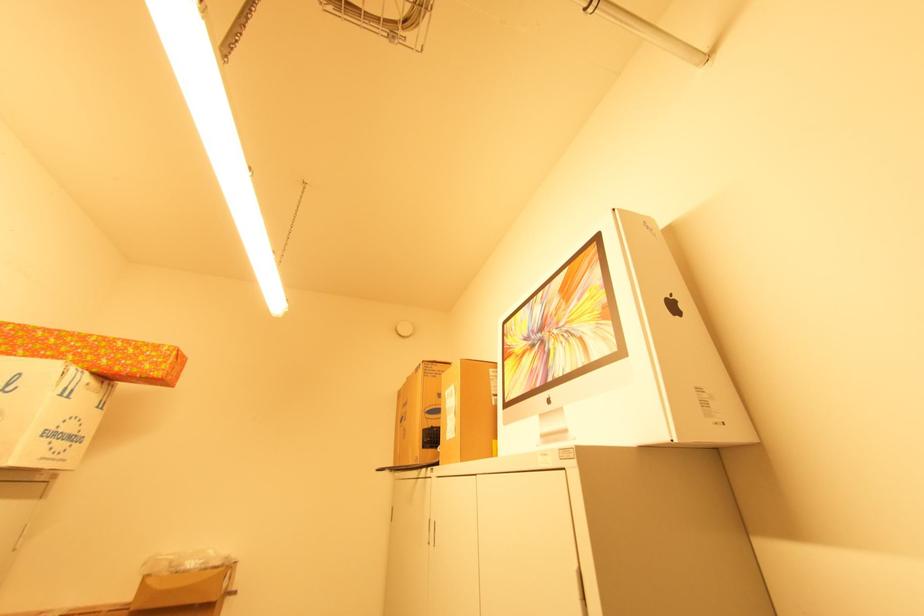
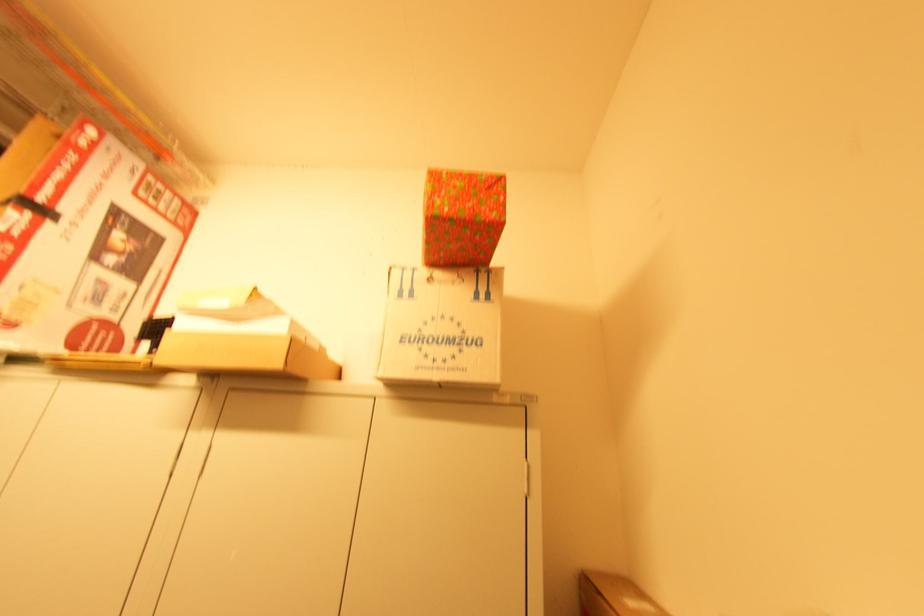
In the second image, find the point that corresponds to (x=55, y=429) in the first image.

(418, 333)